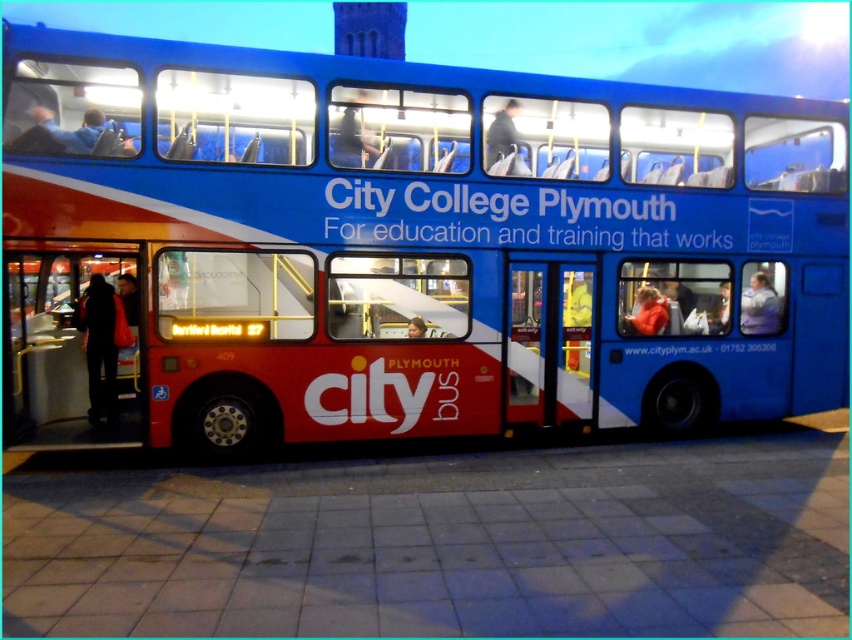
Does blue matte bus at center appear on the right side of metallic red bus stop at left?

Correct, you'll find blue matte bus at center to the right of metallic red bus stop at left.

Between point (9, 163) and point (3, 368), which one is positioned behind?

Positioned behind is point (3, 368).

Where is `blue matte bus at center`? The width and height of the screenshot is (852, 640). blue matte bus at center is located at coordinates (404, 248).

You are a GUI agent. You are given a task and a screenshot of the screen. Output one action in this format:
    pyautogui.click(x=<x>, y=<y>)
    Task: Click on the blue matte bus at center
    The width and height of the screenshot is (852, 640).
    Given the screenshot: What is the action you would take?
    pyautogui.click(x=404, y=248)